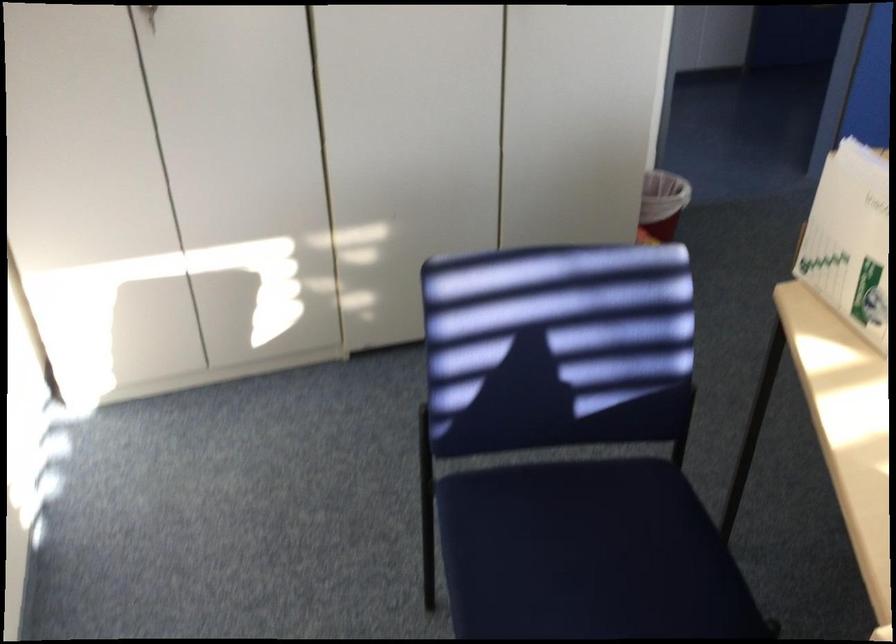
This screenshot has width=896, height=644. What do you see at coordinates (588, 554) in the screenshot?
I see `the blue chair sitting surface` at bounding box center [588, 554].